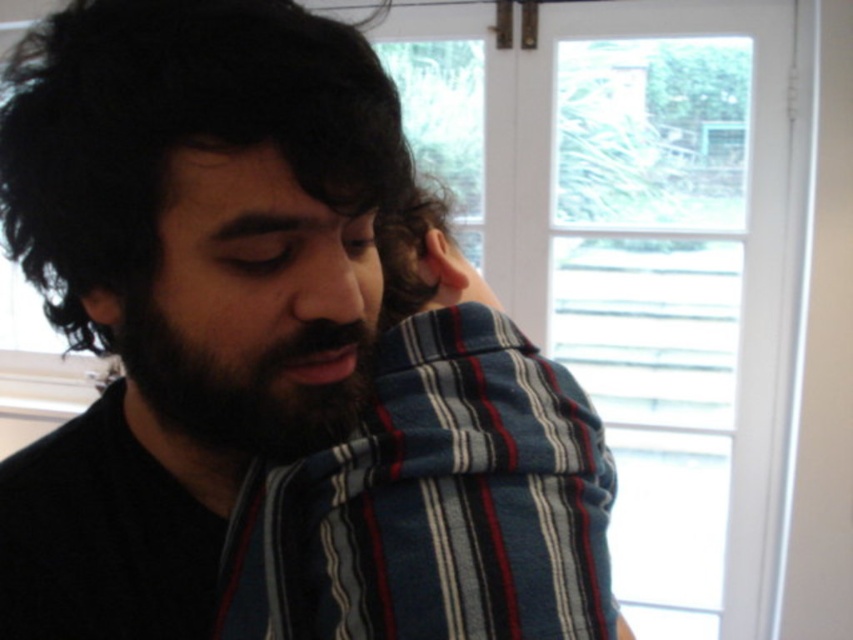
Question: Which point is closer to the camera taking this photo?

Choices:
 (A) (132, 406)
 (B) (276, 124)

Answer: (B)

Question: Can you confirm if blue striped blanket at center is thinner than dark brown fuzzy beard at center?

Choices:
 (A) no
 (B) yes

Answer: (A)

Question: Is dark curly hair at upper left wider than dark brown skin at center?

Choices:
 (A) no
 (B) yes

Answer: (B)

Question: Estimate the real-world distances between objects in this image. Which object is farther from the dark curly hair at upper left?

Choices:
 (A) dark brown skin at center
 (B) blue striped blanket at center

Answer: (A)

Question: Which point appears farthest from the camera in this image?

Choices:
 (A) click(209, 76)
 (B) click(122, 356)
 (C) click(189, 403)
 (D) click(152, 202)

Answer: (B)

Question: Is dark curly hair at upper left thinner than dark brown skin at center?

Choices:
 (A) yes
 (B) no

Answer: (B)